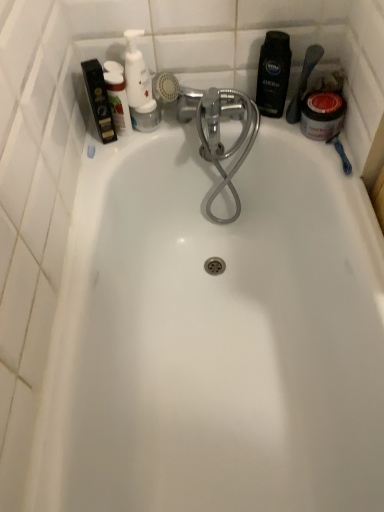
Question: From the image's perspective, is white glossy pump bottle at upper left, the 3th toiletry viewed from the right, above white glossy pump bottle at upper left, which is counted as the second toiletry, starting from the left?

Choices:
 (A) yes
 (B) no

Answer: (B)

Question: Is white glossy pump bottle at upper left, acting as the 1th toiletry starting from the left, positioned beyond the bounds of white glossy pump bottle at upper left, which is counted as the 2th toiletry, starting from the right?

Choices:
 (A) no
 (B) yes

Answer: (B)

Question: Is white glossy pump bottle at upper left, acting as the 1th toiletry starting from the left, with white glossy pump bottle at upper left, which is counted as the 2th toiletry, starting from the right?

Choices:
 (A) no
 (B) yes

Answer: (B)

Question: Is white glossy pump bottle at upper left, acting as the 1th toiletry starting from the left, aimed at white glossy pump bottle at upper left, which is counted as the second toiletry, starting from the left?

Choices:
 (A) yes
 (B) no

Answer: (B)

Question: From the image's perspective, is white glossy pump bottle at upper left, the 3th toiletry viewed from the right, under white glossy pump bottle at upper left, which is counted as the second toiletry, starting from the left?

Choices:
 (A) no
 (B) yes

Answer: (B)

Question: Are white glossy pump bottle at upper left, acting as the 1th toiletry starting from the left, and white glossy pump bottle at upper left, which is counted as the second toiletry, starting from the left, far apart?

Choices:
 (A) no
 (B) yes

Answer: (A)

Question: Would you say matte black jar at upper right is part of deep black shampoo at upper right, marked as the 3th toiletry in a left-to-right arrangement,'s contents?

Choices:
 (A) no
 (B) yes

Answer: (A)

Question: Are deep black shampoo at upper right, acting as the first toiletry starting from the right, and matte black jar at upper right located far from each other?

Choices:
 (A) yes
 (B) no

Answer: (B)

Question: Is deep black shampoo at upper right, acting as the first toiletry starting from the right, taller than matte black jar at upper right?

Choices:
 (A) yes
 (B) no

Answer: (A)

Question: Is deep black shampoo at upper right, acting as the first toiletry starting from the right, with matte black jar at upper right?

Choices:
 (A) no
 (B) yes

Answer: (B)

Question: Does deep black shampoo at upper right, acting as the first toiletry starting from the right, appear on the right side of matte black jar at upper right?

Choices:
 (A) yes
 (B) no

Answer: (B)

Question: From a real-world perspective, is deep black shampoo at upper right, acting as the first toiletry starting from the right, on matte black jar at upper right?

Choices:
 (A) no
 (B) yes

Answer: (B)

Question: From the image's perspective, is matte black jar at upper right located above white glossy pump bottle at upper left, acting as the 1th toiletry starting from the left?

Choices:
 (A) no
 (B) yes

Answer: (A)